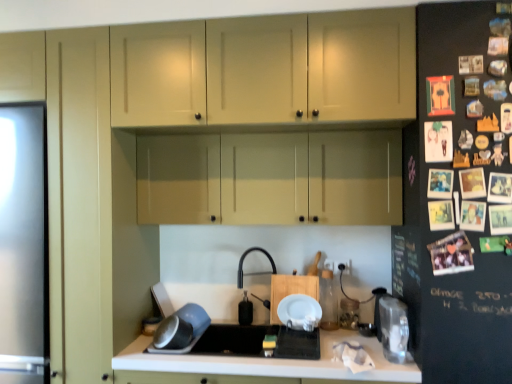
The height and width of the screenshot is (384, 512). Find the location of `free location to the left of transparent plastic container at right, the 1th appliance from the right`. free location to the left of transparent plastic container at right, the 1th appliance from the right is located at coordinates (365, 362).